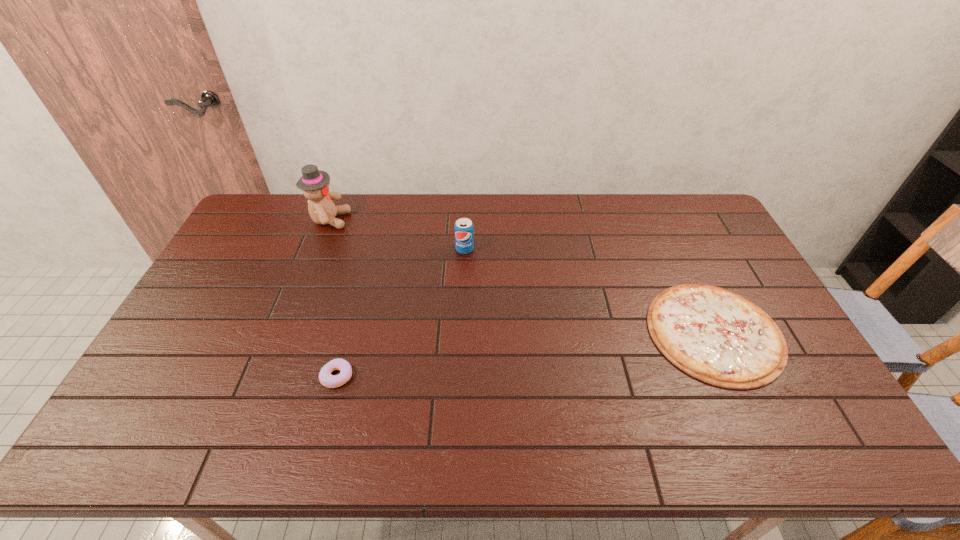
The image size is (960, 540). In order to click on free space that satisfies the following two spatial constraints: 1. on the back side of the doughnut; 2. on the front-facing side of the tallest object in this screenshot , I will do `click(378, 220)`.

Where is `vacant region that satisfies the following two spatial constraints: 1. on the back side of the pizza; 2. on the front-facing side of the leftmost object`? The image size is (960, 540). vacant region that satisfies the following two spatial constraints: 1. on the back side of the pizza; 2. on the front-facing side of the leftmost object is located at coordinates (661, 220).

The height and width of the screenshot is (540, 960). What are the coordinates of `vacant space that satisfies the following two spatial constraints: 1. on the back side of the third object from right to left; 2. on the left side of the third nearest object` in the screenshot? It's located at (371, 249).

This screenshot has width=960, height=540. Identify the location of free spot that satisfies the following two spatial constraints: 1. on the front-facing side of the tallest object; 2. on the right side of the third object from left to right. (318, 249).

You are a GUI agent. You are given a task and a screenshot of the screen. Output one action in this format:
    pyautogui.click(x=<x>, y=<y>)
    Task: Click on the vacant space that satisfies the following two spatial constraints: 1. on the front-facing side of the tallest object; 2. on the back side of the rightmost object
    The height and width of the screenshot is (540, 960).
    Given the screenshot: What is the action you would take?
    pyautogui.click(x=285, y=332)

Identify the location of vacant space that satisfies the following two spatial constraints: 1. on the front-facing side of the rightmost object; 2. on the right side of the farthest object. This screenshot has height=540, width=960. (285, 332).

The width and height of the screenshot is (960, 540). Find the location of `free point that satisfies the following two spatial constraints: 1. on the front-facing side of the third object from right to left; 2. on the right side of the tallest object`. free point that satisfies the following two spatial constraints: 1. on the front-facing side of the third object from right to left; 2. on the right side of the tallest object is located at coordinates (269, 376).